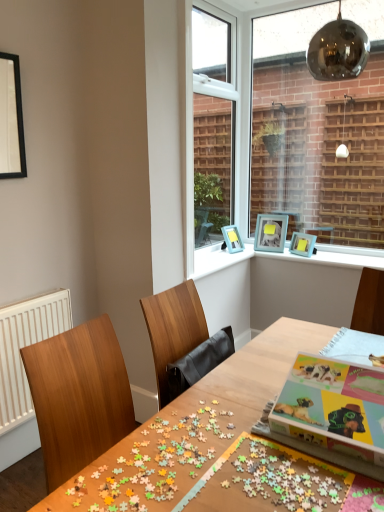
This screenshot has width=384, height=512. Find the location of `vacant area on top of multicolored puzzle pieces at center (from a real-world perspective)`. vacant area on top of multicolored puzzle pieces at center (from a real-world perspective) is located at coordinates (163, 452).